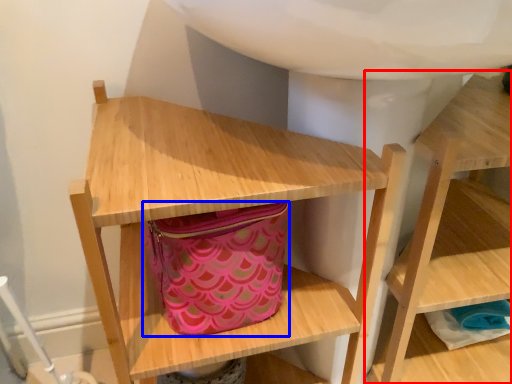
Question: Which object appears closest to the camera in this image, shelf (highlighted by a red box) or bag (highlighted by a blue box)?

Choices:
 (A) shelf
 (B) bag

Answer: (A)